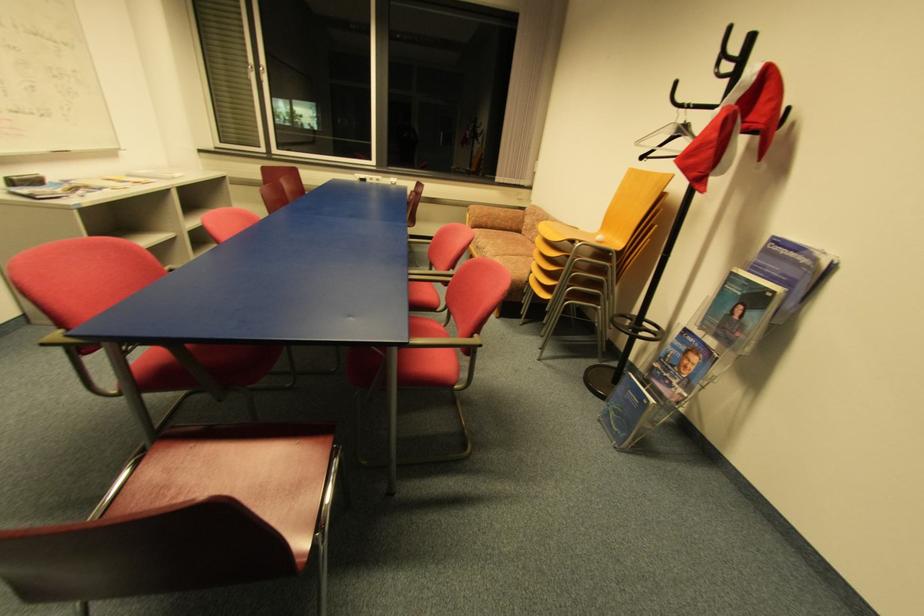
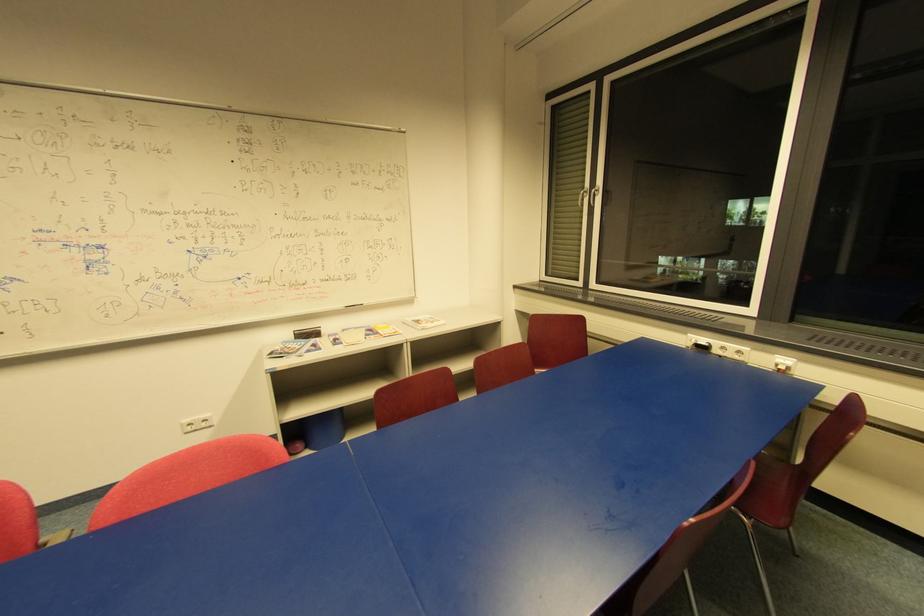
Where in the second image is the point corresponding to point (372, 182) from the first image?

(720, 352)